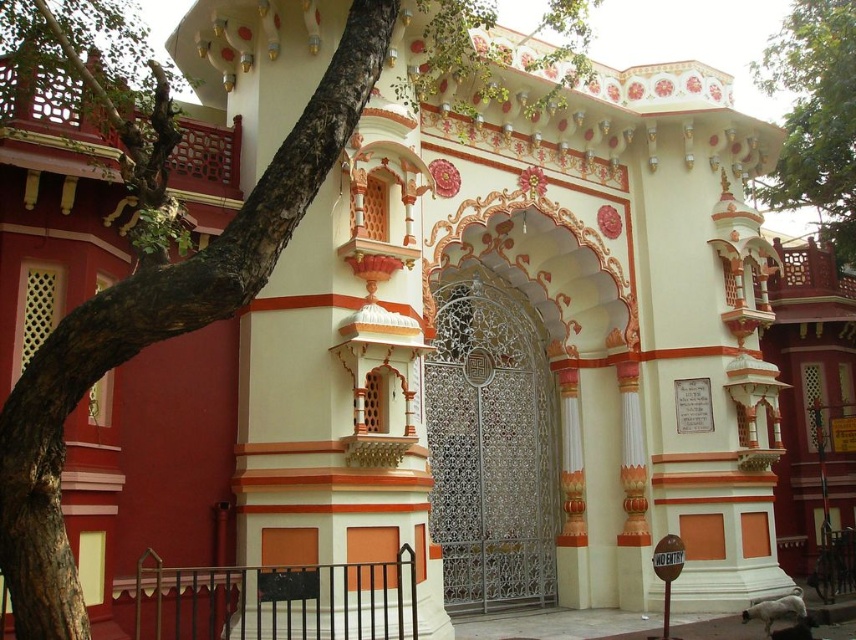
You are standing in front of the ornate temple structure. There are two points marked on the building. The first point is at coordinates point (514, 310) and the second is at point (831, 52). Which point appears closer to you?

Point (514, 310) is closer to the camera than point (831, 52), so the first point appears closer to you.

You are standing at the entrance of the temple and notice two elements in the scene. Can you determine which object is closer to you between the brown rough bark at center left and the green leafy tree at upper right?

The brown rough bark at center left is closer to you as it is positioned in front of the green leafy tree at upper right.

You are a painter planning to paint the brown rough bark at center left and the white metal gate at center. If you have enough paint for one object, which one should you choose to ensure it gets fully painted?

The brown rough bark at center left has a larger width than the white metal gate at center, so you should choose to paint the brown rough bark at center left to ensure it gets fully painted with the available paint.